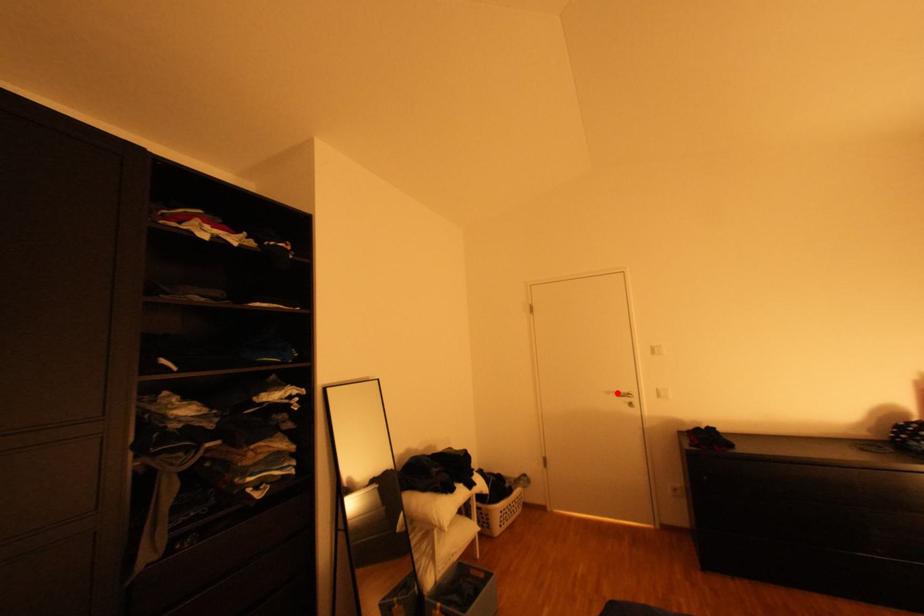
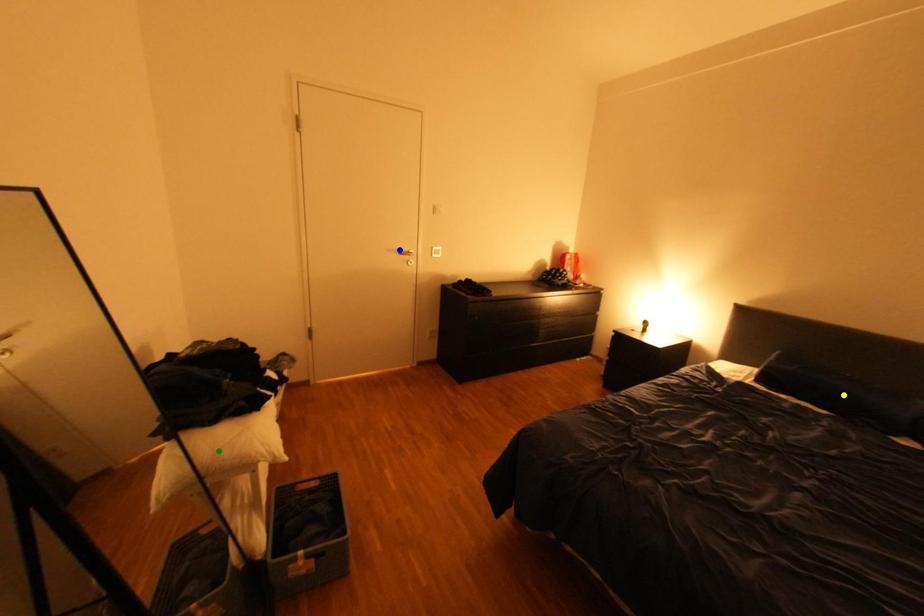
Question: I am providing you with two images of the same scene from different viewpoints. A red point is marked on the first image. You are given multiple points on the second image. Which point in image 2 is actually the same real-world point as the red point in image 1?

Choices:
 (A) green point
 (B) blue point
 (C) yellow point

Answer: (B)